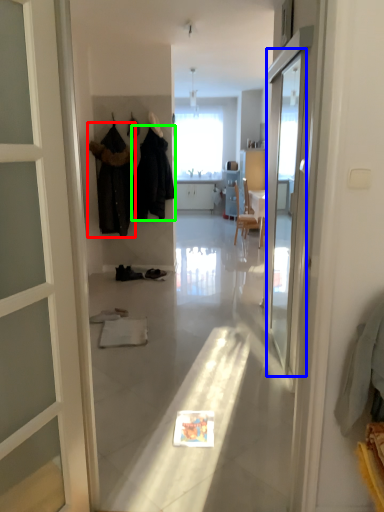
Question: Based on their relative distances, which object is nearer to clothing (highlighted by a red box)? Choose from screen door (highlighted by a blue box) and clothing (highlighted by a green box).

Choices:
 (A) screen door
 (B) clothing

Answer: (B)